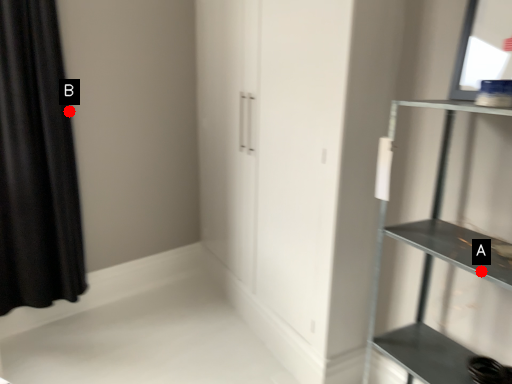
Question: Two points are circled on the image, labeled by A and B beside each circle. Which of the following is the closest to the observer?

Choices:
 (A) A is closer
 (B) B is closer

Answer: (A)